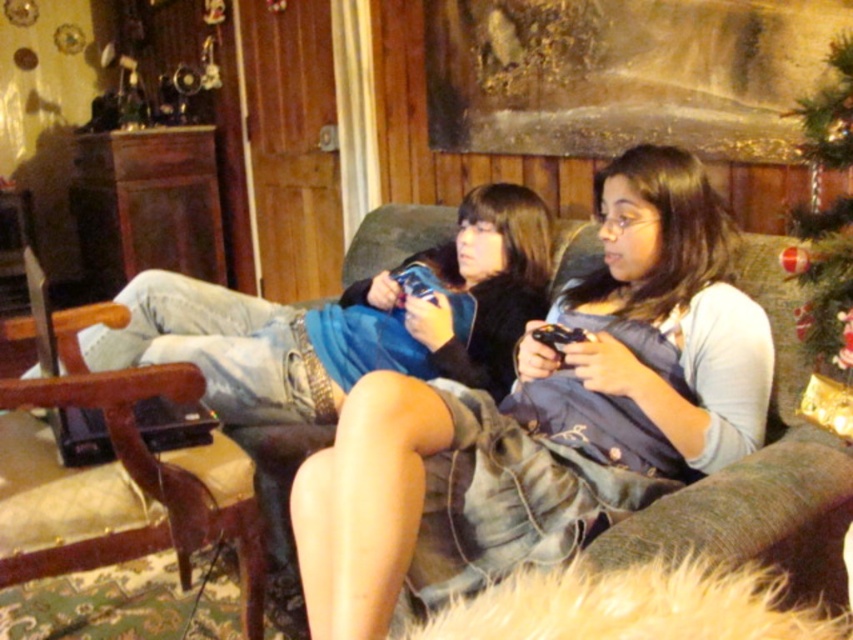
In the scene shown: You are a delivery robot with a box that is 12 inches wide. You need to place the box between the denim shorts at center and the green fabric christmas tree at upper right. Is there enough space for the box?

The distance between the denim shorts at center and the green fabric christmas tree at upper right is 14.47 inches. Since the box is 12 inches wide, there is enough space to place it between them.

You are standing in the living room and want to place a 1.5 meter long decorative rod horizontally on the floor between the two people sitting on the couch. The rod needs to be exactly at the midpoint between them. Given that the point at coordinates point (605, 323) is 1.59 meters away from you, can you determine if the rod will fit without overlapping either person?

The point at coordinates point (605, 323) is 1.59 meters away from the viewer. Since the rod is 1.5 meters long and needs to be placed at the midpoint between the two people, the distance from each person to the midpoint should be at least 0.75 meters. However, without knowing the exact distance between the two people, it is impossible to determine if the rod will fit without overlapping them.